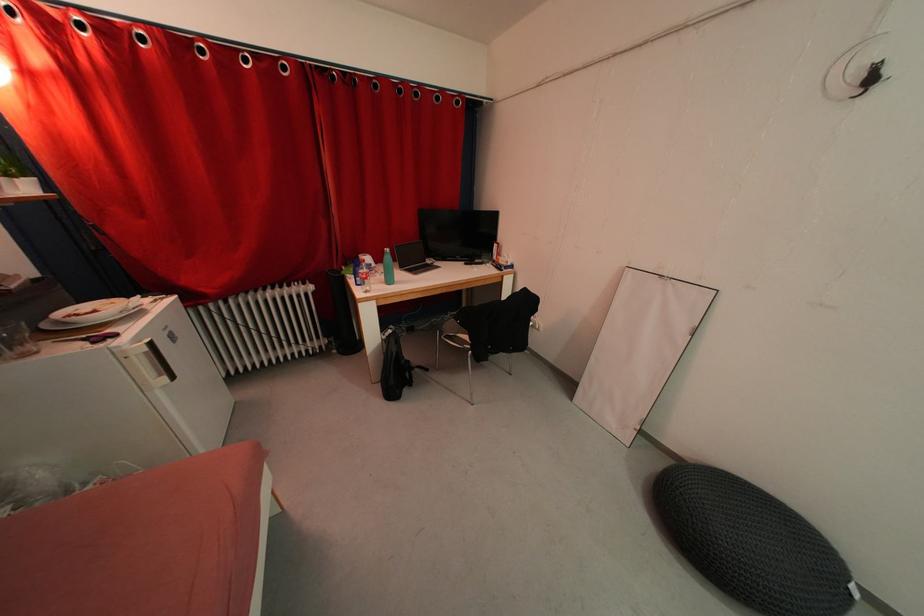
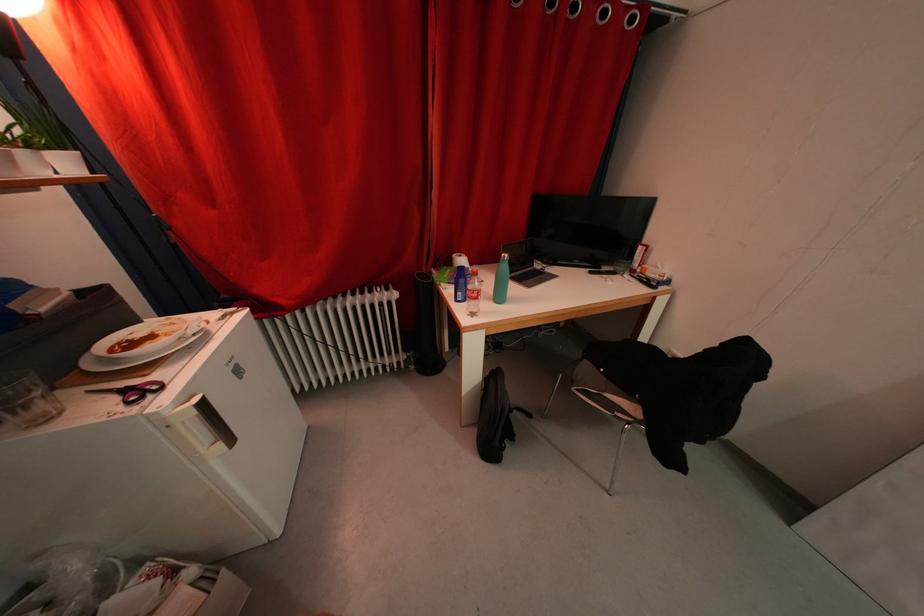
In the second image, find the point that corresponds to (367,275) in the first image.

(476, 291)